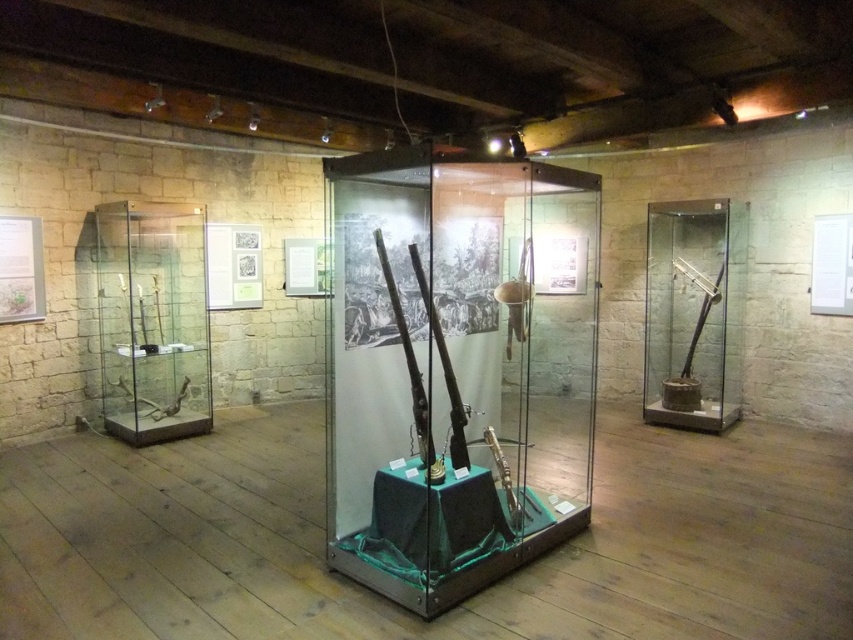
Question: Can you confirm if clear glass case at center is positioned below matte glass display case at left?

Choices:
 (A) no
 (B) yes

Answer: (B)

Question: Which point appears closest to the camera in this image?

Choices:
 (A) (502, 522)
 (B) (676, 416)
 (C) (303, 538)
 (D) (115, 413)

Answer: (A)

Question: Does matte glass display case at left appear under matte black rifle at right?

Choices:
 (A) yes
 (B) no

Answer: (A)

Question: Is metallic gun at center positioned behind matte black rifle at right?

Choices:
 (A) no
 (B) yes

Answer: (A)

Question: Which object is positioned closest to the matte glass display case at left?

Choices:
 (A) matte black rifle at right
 (B) clear glass case at center
 (C) metallic gun at center

Answer: (C)

Question: Considering the real-world distances, which object is farthest from the clear glass case at center?

Choices:
 (A) metallic gun at center
 (B) matte glass display case at left

Answer: (B)